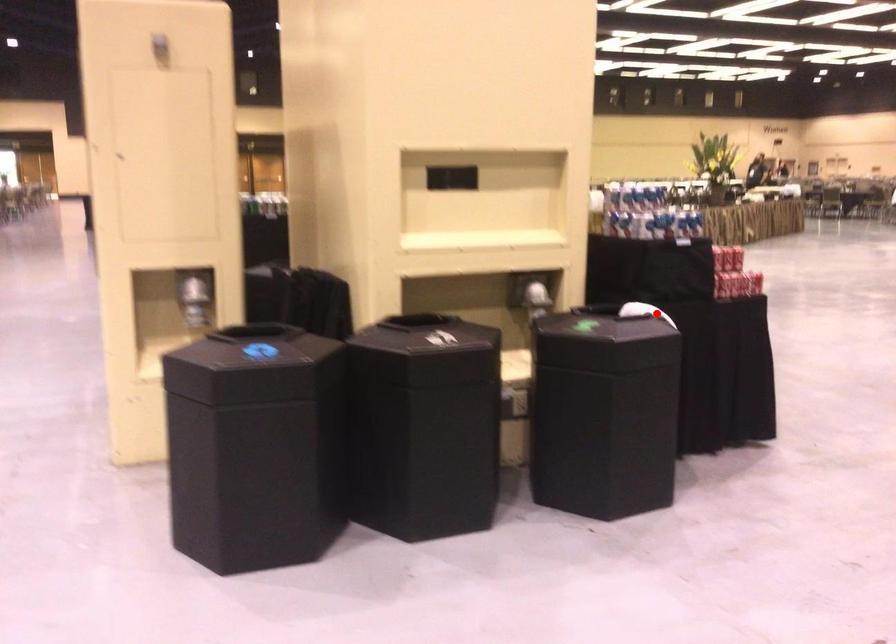
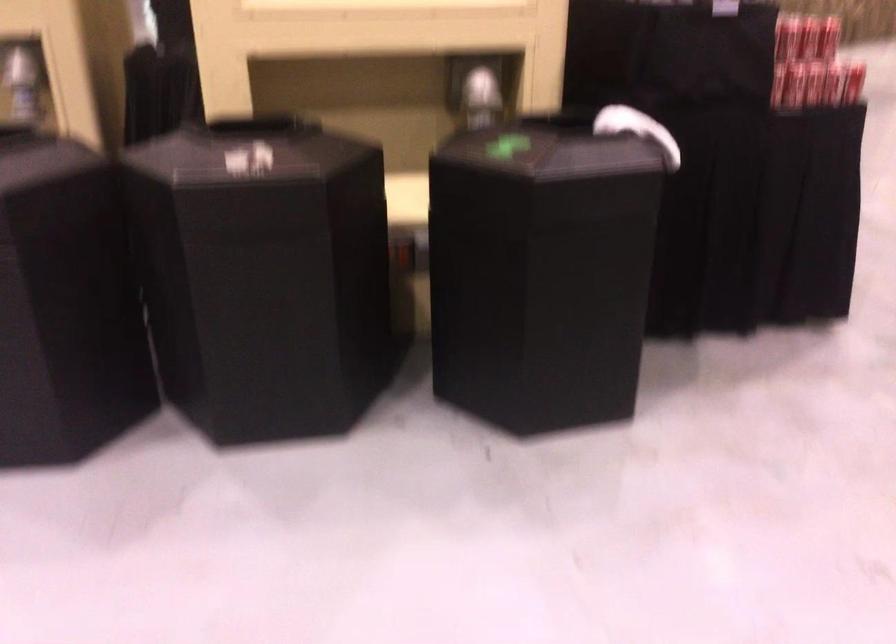
Question: I am providing you with two images of the same scene from different viewpoints. In image1, a red point is highlighted. Considering the same 3D point in image2, which of the following is correct?

Choices:
 (A) It is closer
 (B) It is farther

Answer: (A)